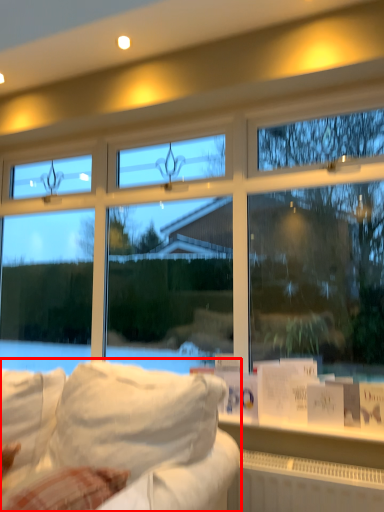
Question: From the image's perspective, where is studio couch (annotated by the red box) located relative to radiator?

Choices:
 (A) above
 (B) below

Answer: (A)